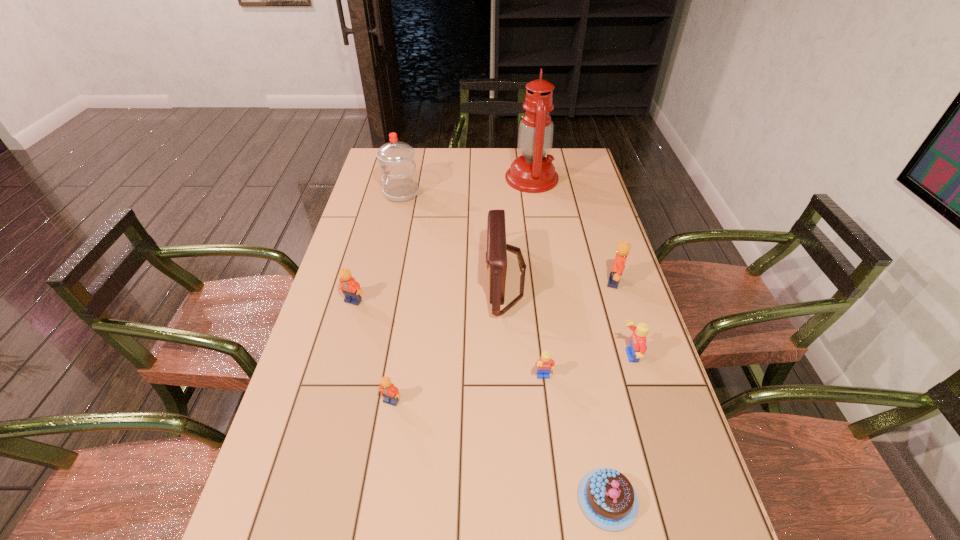
Choose which object is the second nearest neighbor to the fourth Lego from right to left. Please provide its 2D coordinates. Your answer should be formatted as a tuple, i.e. [(x, y)], where the tuple contains the x and y coordinates of a point satisfying the conditions above.

[(351, 289)]

Select which object appears as the fourth closest to the smallest orange Lego. Please provide its 2D coordinates. Your answer should be formatted as a tuple, i.e. [(x, y)], where the tuple contains the x and y coordinates of a point satisfying the conditions above.

[(607, 498)]

Locate an element on the screen. Lego object that ranks as the third closest to the shoulder bag is located at coordinates (623, 248).

Select which Lego appears as the closest to the fourth nearest Lego. Please provide its 2D coordinates. Your answer should be formatted as a tuple, i.e. [(x, y)], where the tuple contains the x and y coordinates of a point satisfying the conditions above.

[(391, 394)]

You are a GUI agent. You are given a task and a screenshot of the screen. Output one action in this format:
    pyautogui.click(x=<x>, y=<y>)
    Task: Click on the third closest orange Lego to the tallest object
    The image size is (960, 540).
    Given the screenshot: What is the action you would take?
    pyautogui.click(x=391, y=394)

Identify the location of orange Lego that is the third closest to the water bottle. (391, 394).

Identify the location of blank area in the image that satisfies the following two spatial constraints: 1. on the front-facing side of the leftmost orange Lego; 2. on the left side of the shortest object. The width and height of the screenshot is (960, 540). (298, 500).

The height and width of the screenshot is (540, 960). Find the location of `vacant space that satisfies the following two spatial constraints: 1. on the front-facing side of the rightmost orange Lego; 2. on the face of the left yellow Lego`. vacant space that satisfies the following two spatial constraints: 1. on the front-facing side of the rightmost orange Lego; 2. on the face of the left yellow Lego is located at coordinates (644, 378).

Image resolution: width=960 pixels, height=540 pixels. Identify the location of blank space that satisfies the following two spatial constraints: 1. on the front-facing side of the tallest Lego; 2. on the face of the left yellow Lego. (644, 378).

Locate an element on the screen. free space that satisfies the following two spatial constraints: 1. on the front-facing side of the biggest orange Lego; 2. on the face of the left yellow Lego is located at coordinates (644, 378).